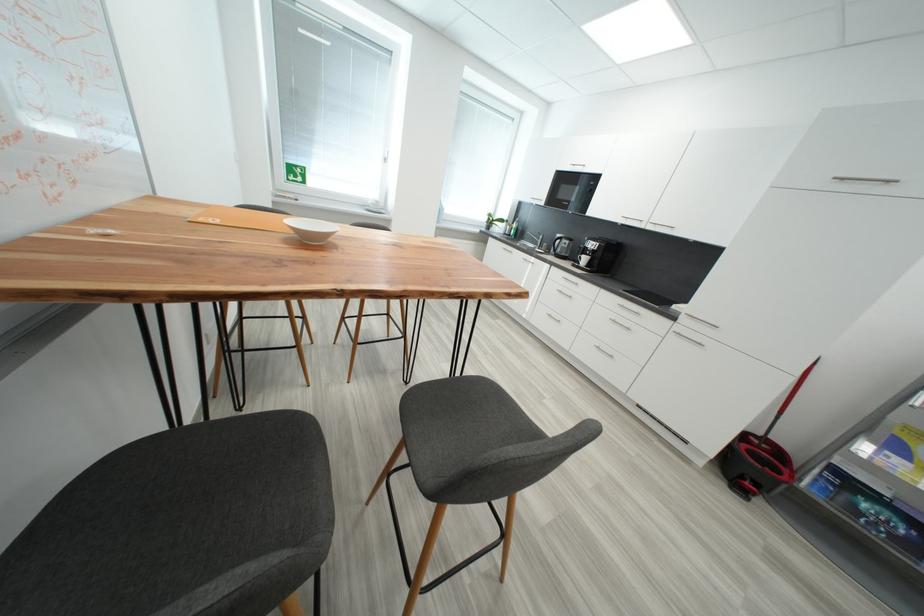
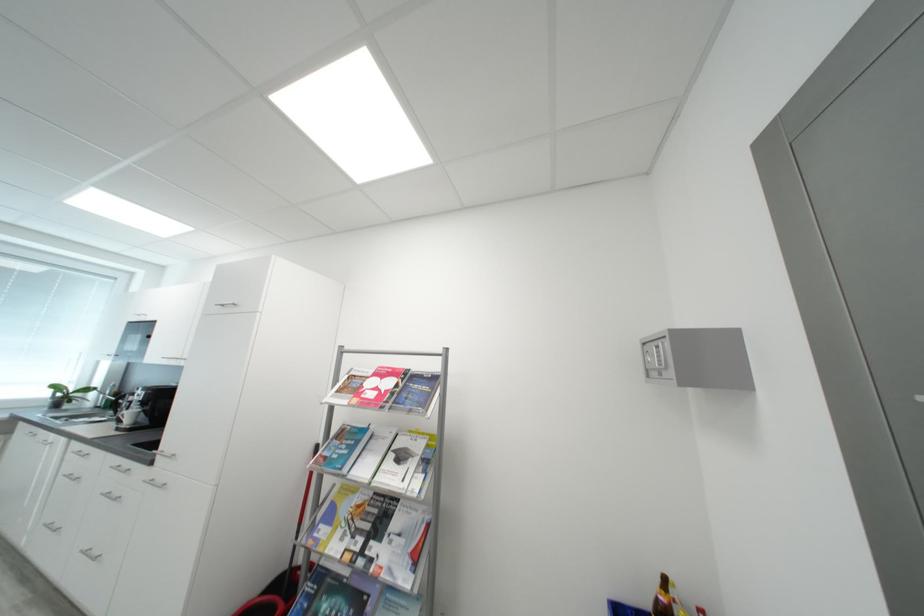
Find the pixel in the second image that matches point (496, 217) in the first image.

(62, 389)